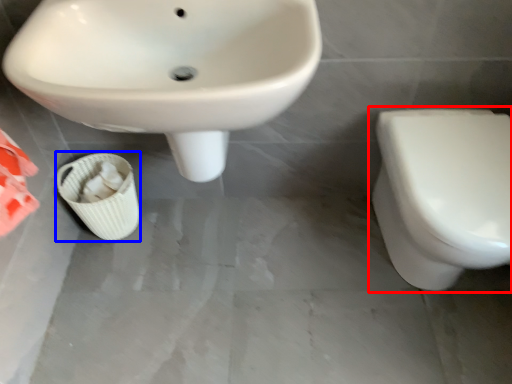
Question: Which of the following is the closest to the observer, toilet (highlighted by a red box) or potty (highlighted by a blue box)?

Choices:
 (A) toilet
 (B) potty

Answer: (A)